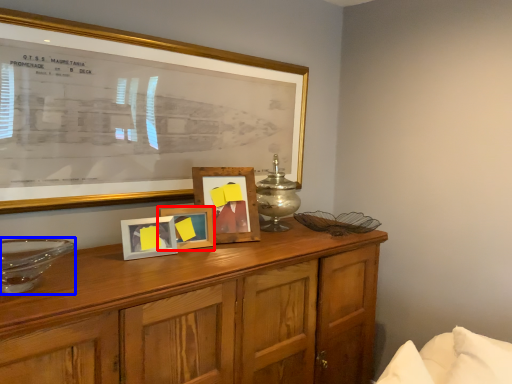
Question: Which of the following is the farthest to the observer, picture frame (highlighted by a red box) or glass bowl (highlighted by a blue box)?

Choices:
 (A) picture frame
 (B) glass bowl

Answer: (A)